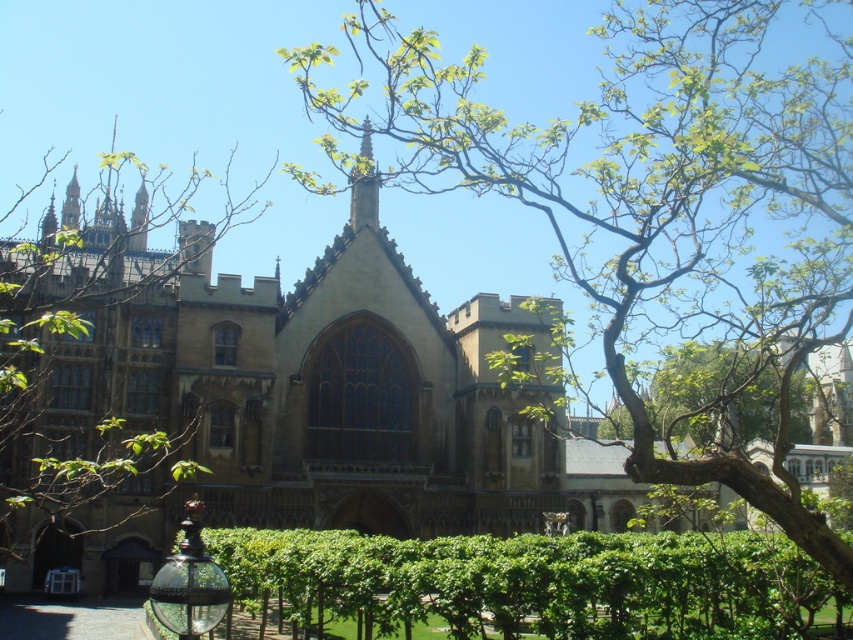
Question: Can you confirm if green leafy tree at center is positioned to the left of green leafy hedge at center?

Choices:
 (A) yes
 (B) no

Answer: (B)

Question: Is green leafy tree at center closer to camera compared to green leafy hedge at center?

Choices:
 (A) no
 (B) yes

Answer: (B)

Question: Which of the following is the farthest from the observer?

Choices:
 (A) (726, 3)
 (B) (641, 557)

Answer: (A)

Question: Among these points, which one is nearest to the camera?

Choices:
 (A) (721, 388)
 (B) (683, 596)

Answer: (B)

Question: Is green leafy tree at center to the left of green leafy hedge at center from the viewer's perspective?

Choices:
 (A) yes
 (B) no

Answer: (B)